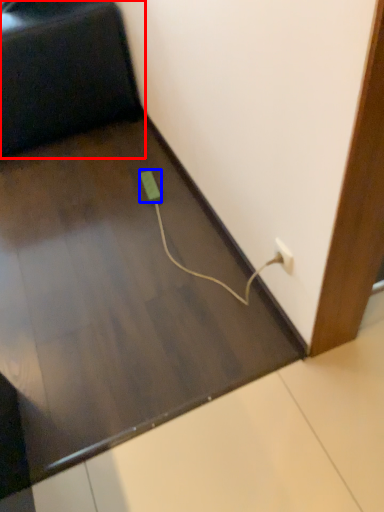
Question: Which object appears closest to the camera in this image, furniture (highlighted by a red box) or socket (highlighted by a blue box)?

Choices:
 (A) furniture
 (B) socket

Answer: (A)